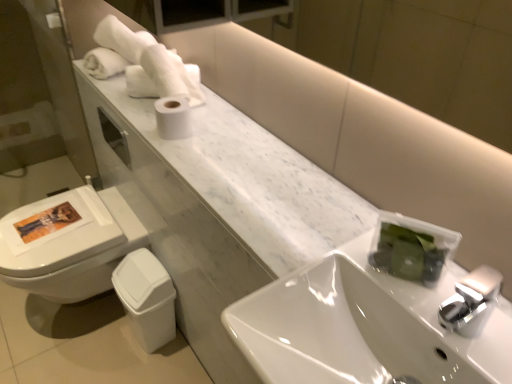
The width and height of the screenshot is (512, 384). Identify the location of free spot above white soft towel at upper left (from a real-world perspective). (114, 7).